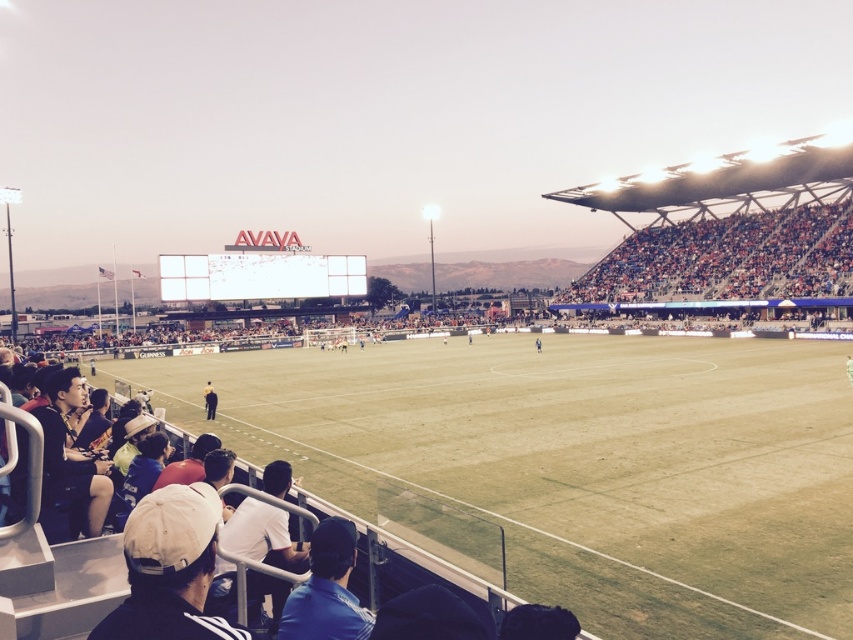
You are a photographer standing at the edge of the AVAYA Stadium field. You want to take a photo that includes both the green grass football field at center and the white fabric cap at lower left. Which object should you focus on first to ensure both are in clear view?

You should focus on the green grass football field at center first because it is closer to you than the white fabric cap at lower left, ensuring both will be in clear view when focused properly.

You are a photographer standing at the center of the AVAYA Stadium field. You want to take a photo that includes both the point at coordinates point (753, 460) and point (613, 296). Which point will appear larger in your photo?

Point (753, 460) is closer to the camera than point (613, 296), so it will appear larger in the photo.